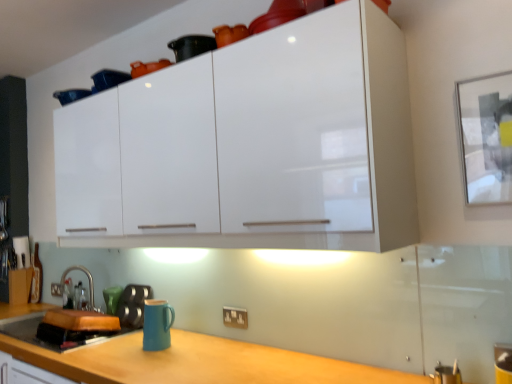
Question: Is satin nickel faucet at lower left spatially inside teal ceramic mug at lower left, or outside of it?

Choices:
 (A) inside
 (B) outside

Answer: (B)

Question: Is satin nickel faucet at lower left wider or thinner than teal ceramic mug at lower left?

Choices:
 (A) wide
 (B) thin

Answer: (A)

Question: Estimate the real-world distances between objects in this image. Which object is farther from the white glossy cabinet at upper center?

Choices:
 (A) white plastic electric outlet at lower center
 (B) matte black kettle at lower left
 (C) teal ceramic mug at lower left
 (D) matte blue mug at lower center
 (E) satin nickel faucet at lower left

Answer: (E)

Question: Which is farther from the satin nickel faucet at lower left?

Choices:
 (A) matte black kettle at lower left
 (B) white glossy cabinet at upper center
 (C) teal ceramic mug at lower left
 (D) white plastic electric outlet at lower center
 (E) matte blue mug at lower center

Answer: (B)